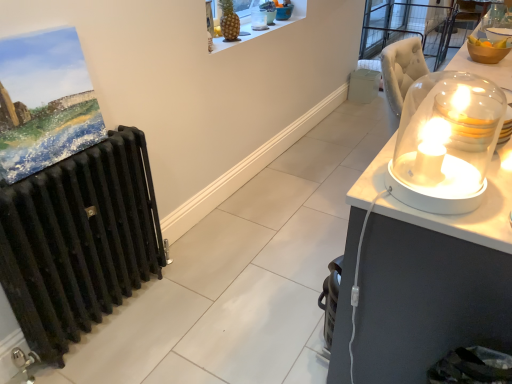
What do you see at coordinates (446, 142) in the screenshot? The width and height of the screenshot is (512, 384). I see `white glossy candle holder at right, which is the second candle holder in left-to-right order` at bounding box center [446, 142].

I want to click on white plastic trash bin/can at right, so click(362, 85).

What is the approximate width of transparent glass dome at right?

Answer: It is 20.69 inches.

Locate an element on the screen. The width and height of the screenshot is (512, 384). transparent glass dome at right is located at coordinates (429, 239).

This screenshot has height=384, width=512. In order to click on translucent glass candle at right, which is the second candle holder from bottom to top in this screenshot , I will do `click(469, 116)`.

Locate an element on the screen. The width and height of the screenshot is (512, 384). translucent glass dome at upper center, which appears as the fourth candle holder when viewed from the right is located at coordinates (258, 19).

Where is `translucent glass dome at upper right, the 1th candle holder viewed from the right`? This screenshot has height=384, width=512. translucent glass dome at upper right, the 1th candle holder viewed from the right is located at coordinates (485, 53).

Where is `white glossy candle holder at right, the fourth candle holder when ordered from top to bottom`? The width and height of the screenshot is (512, 384). white glossy candle holder at right, the fourth candle holder when ordered from top to bottom is located at coordinates (446, 142).

Considering the positions of point (439, 106) and point (371, 101), is point (439, 106) closer or farther from the camera than point (371, 101)?

Clearly, point (439, 106) is closer to the camera than point (371, 101).

Could you measure the distance between translucent glass candle at right, which is the second candle holder from bottom to top, and white plastic trash bin/can at right?

They are 9.07 feet apart.

From the image's perspective, relative to white plastic trash bin/can at right, is translucent glass candle at right, the second candle holder in the right-to-left sequence, above or below?

From the image's perspective, translucent glass candle at right, the second candle holder in the right-to-left sequence, appears below white plastic trash bin/can at right.

Is translucent glass candle at right, the second candle holder in the right-to-left sequence, facing towards white plastic trash bin/can at right?

No.

Is translucent glass candle at right, placed as the third candle holder when sorted from back to front, a part of white plastic trash bin/can at right?

No.

Between white plastic trash bin/can at right and translucent glass candle at right, which is the second candle holder from bottom to top, which one is positioned behind?

white plastic trash bin/can at right.

Which is less distant, (373, 82) or (487, 95)?

Point (487, 95)

Considering the points (490, 93) and (366, 82), which point is behind, point (490, 93) or point (366, 82)?

The point (366, 82) is more distant.

Is white glossy candle holder at right, which appears as the fourth candle holder when viewed from the back, situated inside white plastic trash bin/can at right or outside?

white glossy candle holder at right, which appears as the fourth candle holder when viewed from the back, is located beyond the bounds of white plastic trash bin/can at right.

Is white glossy candle holder at right, the 3th candle holder when ordered from right to left, smaller than white plastic trash bin/can at right?

No.

From a real-world perspective, relative to white plastic trash bin/can at right, is white glossy candle holder at right, which appears as the fourth candle holder when viewed from the back, vertically above or below?

In terms of real-world spatial position, white glossy candle holder at right, which appears as the fourth candle holder when viewed from the back, is above white plastic trash bin/can at right.

From the image's perspective, between translucent glass dome at upper right, positioned as the second candle holder in top-to-bottom order, and white plastic trash bin/can at right, which one is located above?

white plastic trash bin/can at right appears higher in the image.

Looking at their sizes, would you say translucent glass dome at upper right, the 1th candle holder viewed from the right, is wider or thinner than white plastic trash bin/can at right?

Clearly, translucent glass dome at upper right, the 1th candle holder viewed from the right, has less width compared to white plastic trash bin/can at right.

Is point (476, 50) closer to viewer compared to point (372, 99)?

Yes, it is in front of point (372, 99).

Is translucent glass dome at upper right, which is the 3th candle holder from bottom to top, beside white plastic trash bin/can at right?

No.

Between golden pineapple at upper center and white glossy candle holder at right, the 3th candle holder when ordered from right to left, which one appears on the right side from the viewer's perspective?

white glossy candle holder at right, the 3th candle holder when ordered from right to left, is more to the right.

Is golden pineapple at upper center with white glossy candle holder at right, the fourth candle holder when ordered from top to bottom?

golden pineapple at upper center and white glossy candle holder at right, the fourth candle holder when ordered from top to bottom, are clearly separated.

From a real-world perspective, is golden pineapple at upper center over white glossy candle holder at right, which is the second candle holder in left-to-right order?

Yes, from a real-world perspective, golden pineapple at upper center is over white glossy candle holder at right, which is the second candle holder in left-to-right order

Does point (485, 88) come farther from viewer compared to point (453, 120)?

Yes, point (485, 88) is farther from viewer.

What are the coordinates of `desk behind the white glossy candle holder at right, the 1th candle holder positioned from the front` in the screenshot? It's located at (429, 239).

From the image's perspective, who appears lower, white glossy candle holder at right, the 1th candle holder positioned from the front, or transparent glass dome at right?

white glossy candle holder at right, the 1th candle holder positioned from the front, appears lower in the image.

Between white glossy candle holder at right, which is the second candle holder in left-to-right order, and transparent glass dome at right, which one is positioned in front?

Positioned in front is white glossy candle holder at right, which is the second candle holder in left-to-right order.

Between white plastic trash bin/can at right and translucent glass dome at upper right, which appears as the 3th candle holder when viewed from the front, which one has smaller width?

With smaller width is translucent glass dome at upper right, which appears as the 3th candle holder when viewed from the front.

Between white plastic trash bin/can at right and translucent glass dome at upper right, positioned as the second candle holder in top-to-bottom order, which one has smaller size?

translucent glass dome at upper right, positioned as the second candle holder in top-to-bottom order, is smaller.

From the image's perspective, is white plastic trash bin/can at right below translucent glass dome at upper right, marked as the second candle holder in a back-to-front arrangement?

No, from the image's perspective, white plastic trash bin/can at right is not below translucent glass dome at upper right, marked as the second candle holder in a back-to-front arrangement.

Considering the sizes of objects white plastic trash bin/can at right and translucent glass dome at upper right, which is the 3th candle holder from bottom to top, in the image provided, who is shorter, white plastic trash bin/can at right or translucent glass dome at upper right, which is the 3th candle holder from bottom to top,?

With less height is translucent glass dome at upper right, which is the 3th candle holder from bottom to top.

Locate an element on the screen. the 2nd candle holder positioned below the white plastic trash bin/can at right (from the image's perspective) is located at coordinates (469, 116).

You are a GUI agent. You are given a task and a screenshot of the screen. Output one action in this format:
    pyautogui.click(x=<x>, y=<y>)
    Task: Click on the 2nd candle holder located above the white plastic trash bin/can at right (from a real-world perspective)
    The height and width of the screenshot is (384, 512).
    Given the screenshot: What is the action you would take?
    pyautogui.click(x=469, y=116)

Estimate the real-world distances between objects in this image. Which object is closer to matte acrylic painting at left, transparent glass dome at right or white plastic trash bin/can at right?

transparent glass dome at right.

From the image, which object appears to be nearer to translucent glass candle at right, the second candle holder in the right-to-left sequence, white plastic trash bin/can at right or matte acrylic painting at left?

matte acrylic painting at left lies closer to translucent glass candle at right, the second candle holder in the right-to-left sequence, than the other object.

When comparing their distances from translucent glass dome at upper center, the first candle holder positioned from the back, does golden pineapple at upper center or white glossy candle holder at right, the 1th candle holder positioned from the front, seem closer?

golden pineapple at upper center is positioned closer to the anchor translucent glass dome at upper center, the first candle holder positioned from the back.

Considering their positions, is matte acrylic painting at left positioned further to golden pineapple at upper center than white glossy candle holder at right, the 3th candle holder when ordered from right to left?

white glossy candle holder at right, the 3th candle holder when ordered from right to left, is further to golden pineapple at upper center.

When comparing their distances from translucent glass dome at upper right, marked as the second candle holder in a back-to-front arrangement, does translucent glass dome at upper center, the 1th candle holder viewed from the top, or transparent glass dome at right seem closer?

transparent glass dome at right is positioned closer to the anchor translucent glass dome at upper right, marked as the second candle holder in a back-to-front arrangement.

Considering their positions, is golden pineapple at upper center positioned further to translucent glass candle at right, which ranks as the 3th candle holder in left-to-right order, than black cast iron radiator at left?

golden pineapple at upper center is positioned further to the anchor translucent glass candle at right, which ranks as the 3th candle holder in left-to-right order.

Based on the photo, based on their spatial positions, is black cast iron radiator at left or white glossy candle holder at right, the fourth candle holder when ordered from top to bottom, further from golden pineapple at upper center?

Among the two, white glossy candle holder at right, the fourth candle holder when ordered from top to bottom, is located further to golden pineapple at upper center.

Considering their positions, is white glossy candle holder at right, the 3th candle holder when ordered from right to left, positioned closer to white plastic trash bin/can at right than matte acrylic painting at left?

Based on the image, white glossy candle holder at right, the 3th candle holder when ordered from right to left, appears to be nearer to white plastic trash bin/can at right.

Locate an element on the screen. This screenshot has height=384, width=512. radiator between matte acrylic painting at left and translucent glass dome at upper center, which appears as the fourth candle holder when ordered from the bottom, from front to back is located at coordinates (79, 240).

The width and height of the screenshot is (512, 384). I want to click on radiator located between white glossy candle holder at right, the 1th candle holder positioned from the front, and translucent glass dome at upper center, which is the 4th candle holder from front to back, in the depth direction, so click(x=79, y=240).

This screenshot has width=512, height=384. Identify the location of desk located between black cast iron radiator at left and translucent glass dome at upper right, marked as the second candle holder in a back-to-front arrangement, in the left-right direction. (429, 239).

Locate an element on the screen. The width and height of the screenshot is (512, 384). fruit located between translucent glass candle at right, placed as the third candle holder when sorted from back to front, and translucent glass dome at upper center, the 1th candle holder viewed from the top, in the depth direction is located at coordinates (229, 21).